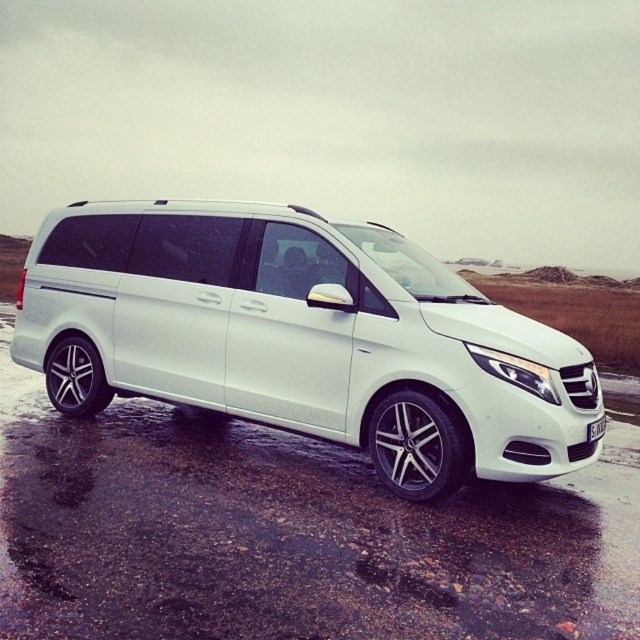
Question: Is white metallic van at center to the left of white plastic license plate at lower right from the viewer's perspective?

Choices:
 (A) no
 (B) yes

Answer: (B)

Question: Is white metallic van at center to the right of white plastic license plate at lower right from the viewer's perspective?

Choices:
 (A) no
 (B) yes

Answer: (A)

Question: Among these points, which one is farthest from the camera?

Choices:
 (A) (170, 288)
 (B) (595, 436)

Answer: (A)

Question: Is white metallic van at center smaller than white plastic license plate at lower right?

Choices:
 (A) yes
 (B) no

Answer: (B)